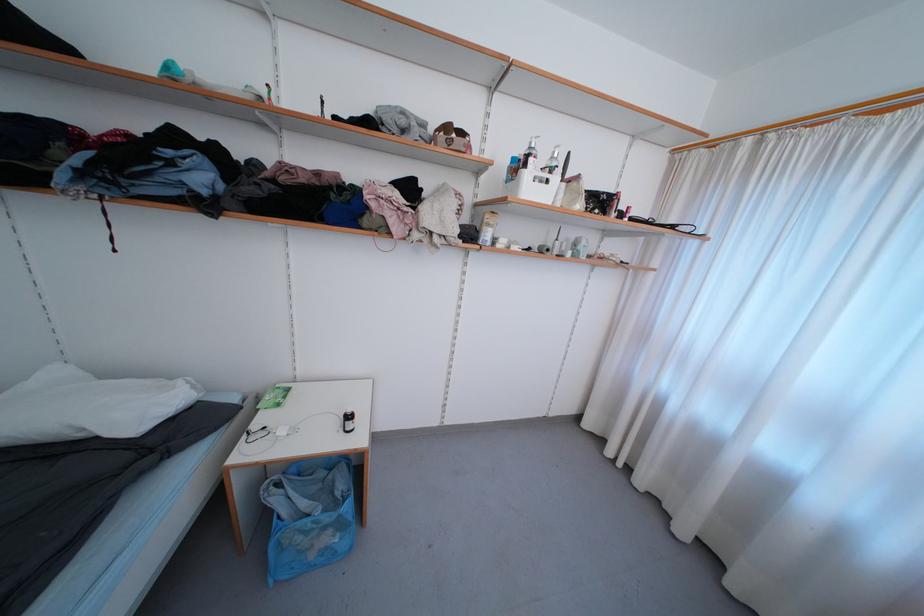
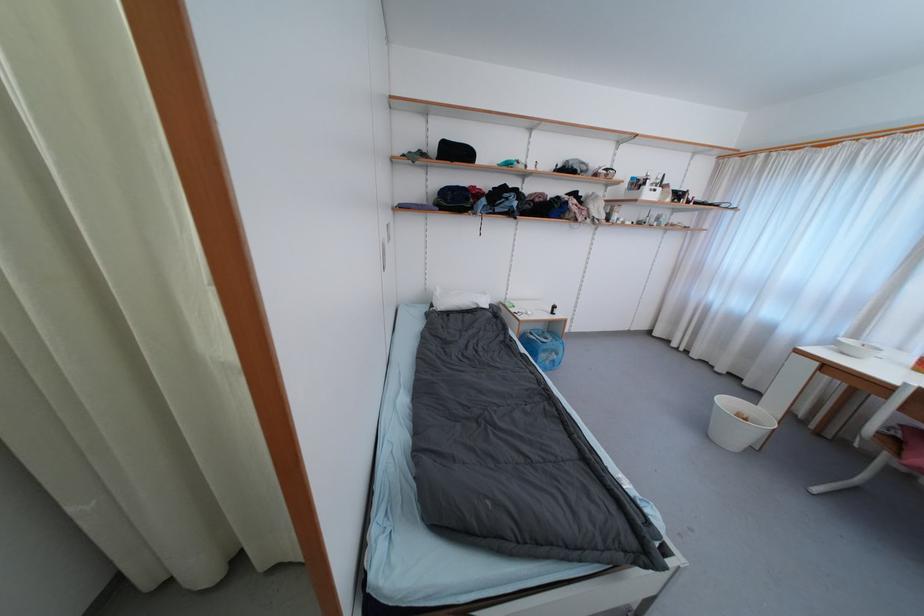
Find the pixel in the second image that matches the point at 354,429 in the first image.

(560, 313)